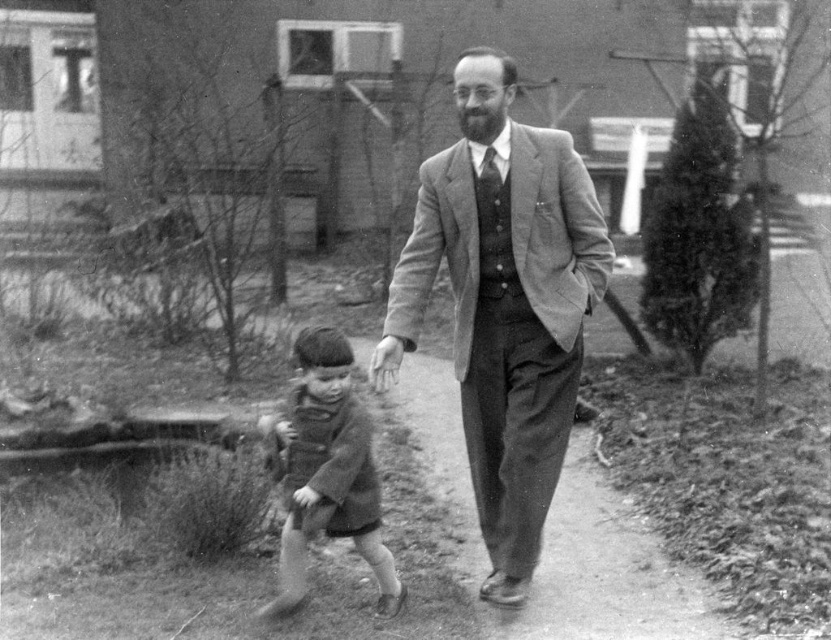
Can you confirm if dull gray concrete at center is wider than coarse wool sweater at center?

Correct, the width of dull gray concrete at center exceeds that of coarse wool sweater at center.

Who is more distant from viewer, (583, 528) or (337, 442)?

The point (583, 528) is more distant.

Is point (574, 474) positioned before point (327, 412)?

No, it is behind (327, 412).

You are a GUI agent. You are given a task and a screenshot of the screen. Output one action in this format:
    pyautogui.click(x=<x>, y=<y>)
    Task: Click on the dull gray concrete at center
    The image size is (831, 640).
    Given the screenshot: What is the action you would take?
    pyautogui.click(x=556, y=538)

The image size is (831, 640). I want to click on smooth woolen suit at center, so click(504, 301).

Who is more forward, (578, 260) or (564, 636)?

Positioned in front is point (564, 636).

Find the location of a particular element. This screenshot has height=640, width=831. smooth woolen suit at center is located at coordinates (504, 301).

At what (x,y) coordinates should I click in order to perform the action: click on smooth woolen suit at center. Please return your answer as a coordinate pair (x, y). Looking at the image, I should click on (504, 301).

Where is `smooth woolen suit at center`? The image size is (831, 640). smooth woolen suit at center is located at coordinates (504, 301).

Does smooth woolen suit at center appear on the left side of coarse wool sweater at center?

No, smooth woolen suit at center is not to the left of coarse wool sweater at center.

Which is behind, point (510, 404) or point (302, 461)?

The point (510, 404) is behind.

Where is `smooth woolen suit at center`? The height and width of the screenshot is (640, 831). smooth woolen suit at center is located at coordinates (504, 301).